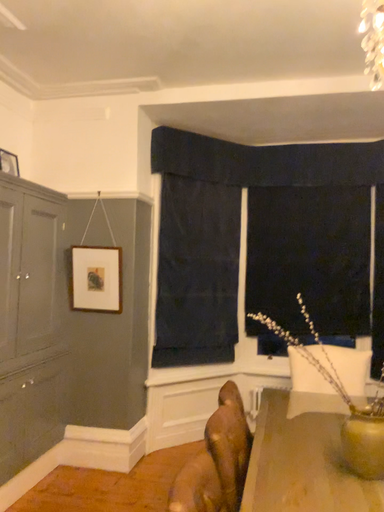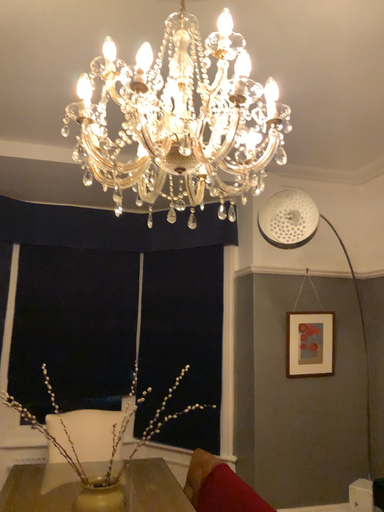
Question: How did the camera likely rotate when shooting the video?

Choices:
 (A) rotated downward
 (B) rotated upward

Answer: (B)